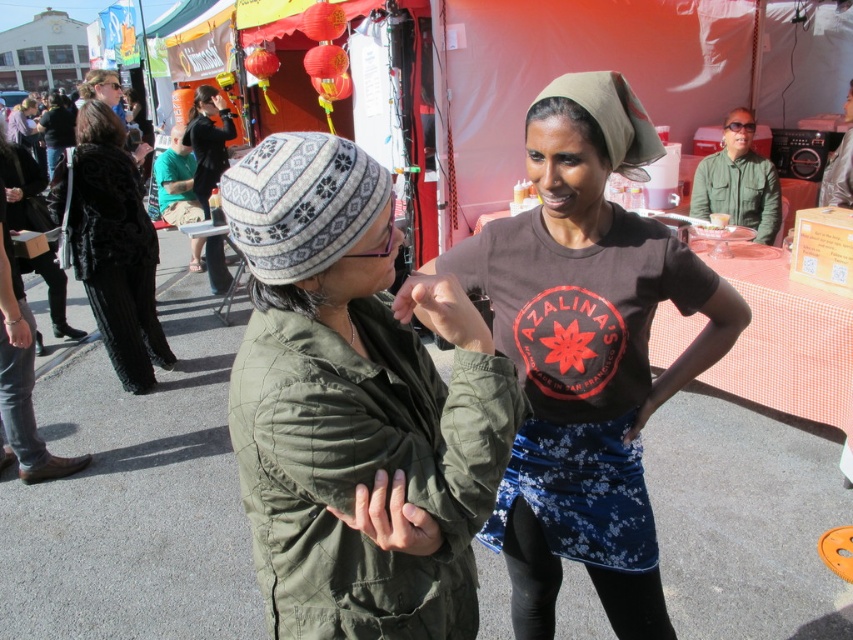
Does matte brown t-shirt at center have a lesser width compared to black fur coat at left?

No, matte brown t-shirt at center is not thinner than black fur coat at left.

Locate an element on the screen. This screenshot has width=853, height=640. matte brown t-shirt at center is located at coordinates (585, 355).

Image resolution: width=853 pixels, height=640 pixels. I want to click on matte brown t-shirt at center, so click(x=585, y=355).

Can you confirm if knitted woolen hat at center is taller than matte brown t-shirt at center?

No, knitted woolen hat at center is not taller than matte brown t-shirt at center.

Between knitted woolen hat at center and matte brown t-shirt at center, which one has less height?

Standing shorter between the two is knitted woolen hat at center.

Find the location of `knitted woolen hat at center`. knitted woolen hat at center is located at coordinates (354, 401).

Image resolution: width=853 pixels, height=640 pixels. Find the location of `knitted woolen hat at center`. knitted woolen hat at center is located at coordinates (354, 401).

Which is above, knitted woolen hat at center or black fur coat at left?

black fur coat at left is higher up.

Is point (364, 355) positioned behind point (93, 198)?

No, it is in front of (93, 198).

Find the location of `knitted woolen hat at center`. knitted woolen hat at center is located at coordinates (354, 401).